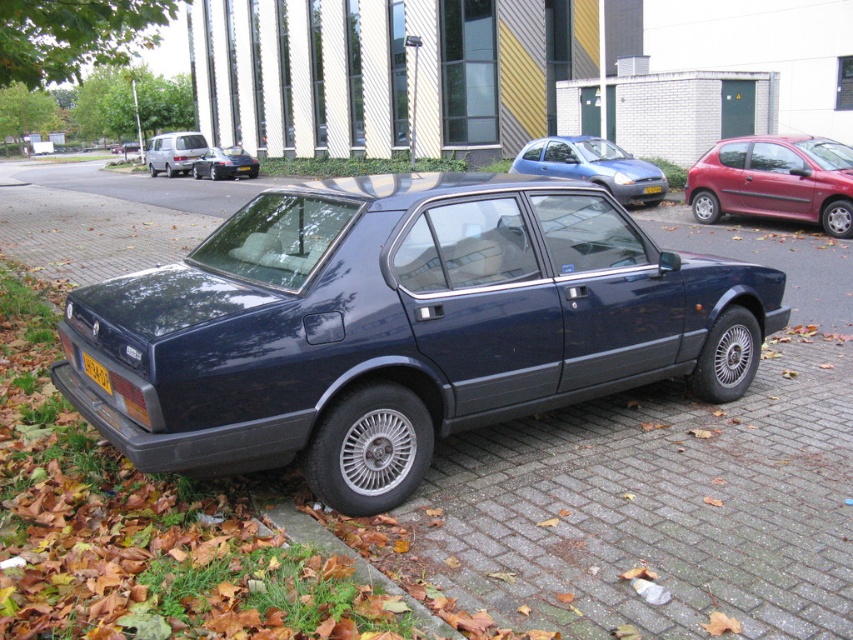
Question: Is matte blue sedan at center bigger than yellow matte license plate at bottom?

Choices:
 (A) yes
 (B) no

Answer: (A)

Question: Can you confirm if matte blue sedan at center is positioned below matte black sedan at upper left?

Choices:
 (A) yes
 (B) no

Answer: (A)

Question: Considering the real-world distances, which object is farthest from the matte blue sedan at center?

Choices:
 (A) metallic red hatchback at right
 (B) brick pavement at lower center

Answer: (B)

Question: Estimate the real-world distances between objects in this image. Which object is farther from the brick pavement at lower center?

Choices:
 (A) matte blue sedan at center
 (B) satin dark blue sedan at center
 (C) metallic red hatchback at right

Answer: (A)

Question: Can you confirm if matte black sedan at upper left is smaller than glossy black sedan at center?

Choices:
 (A) yes
 (B) no

Answer: (B)

Question: Estimate the real-world distances between objects in this image. Which object is farther from the satin dark blue sedan at center?

Choices:
 (A) matte black sedan at upper left
 (B) metallic red hatchback at right

Answer: (A)